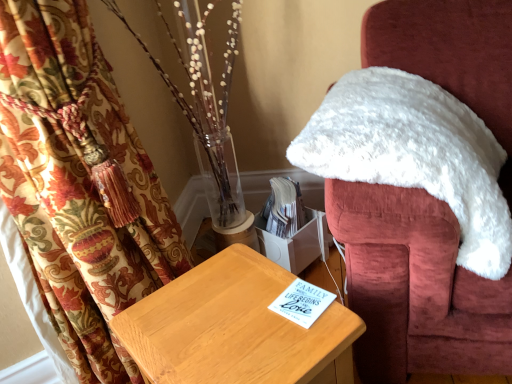
Question: Is light brown wooden table at center bigger or smaller than white fluffy chair at upper right?

Choices:
 (A) big
 (B) small

Answer: (B)

Question: Is light brown wooden table at center wider or thinner than white fluffy chair at upper right?

Choices:
 (A) wide
 (B) thin

Answer: (B)

Question: Would you say light brown wooden table at center is inside or outside white fluffy chair at upper right?

Choices:
 (A) outside
 (B) inside

Answer: (A)

Question: From a real-world perspective, relative to light brown wooden table at center, is white fluffy chair at upper right vertically above or below?

Choices:
 (A) above
 (B) below

Answer: (A)

Question: Is white fluffy chair at upper right situated inside light brown wooden table at center or outside?

Choices:
 (A) inside
 (B) outside

Answer: (B)

Question: Does point (430, 296) appear closer or farther from the camera than point (184, 304)?

Choices:
 (A) farther
 (B) closer

Answer: (A)

Question: In terms of width, does white fluffy chair at upper right look wider or thinner when compared to light brown wooden table at center?

Choices:
 (A) wide
 (B) thin

Answer: (A)